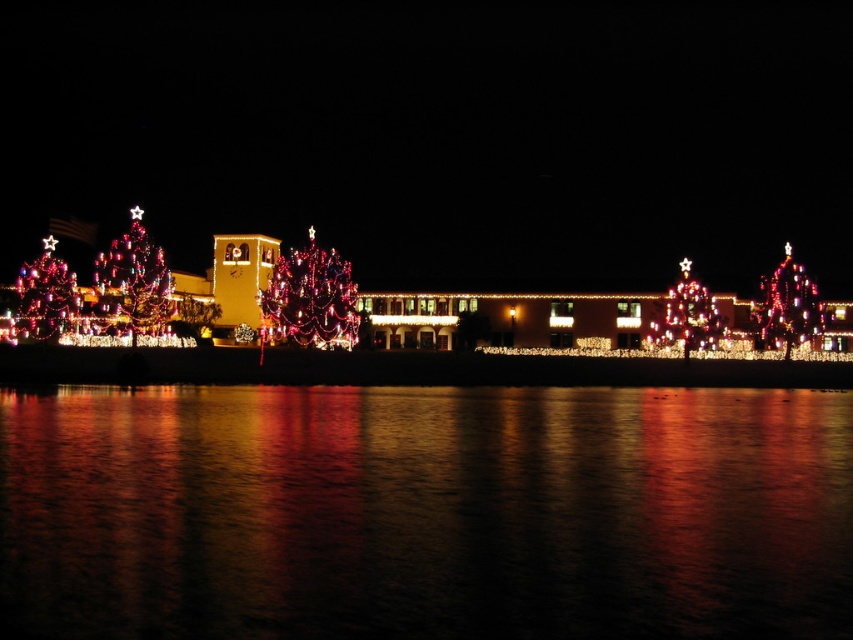
You are a photographer wanting to capture the festive scene. You notice two shiny red christmas tree at left and shiny metallic christmas tree at left. Which tree should you focus on if you want to photograph the taller tree?

The shiny metallic christmas tree at left is taller than the shiny red christmas tree at left, so you should focus on the shiny metallic christmas tree at left to capture the taller tree.

You are a photographer standing at the edge of the waterfront. You want to capture a photo that includes both the glossy reflective water at center and the shiny metallic christmas tree at left. Which object should you focus on first if you want to ensure both are in frame without moving the camera?

The glossy reflective water at center is bigger than the shiny metallic christmas tree at left, so you should focus on the shiny metallic christmas tree at left first to ensure it fits within the frame while still capturing the larger reflective water area.

You are a photographer standing at the waterfront. You want to capture a photo that includes both the shiny metallic christmas tree at left and the glossy reflective water at center. Based on their sizes in the scene, which object will appear larger in your photo?

The shiny metallic christmas tree at left will appear larger in the photo because it is taller than the glossy reflective water at center, which is not as tall as the tree.